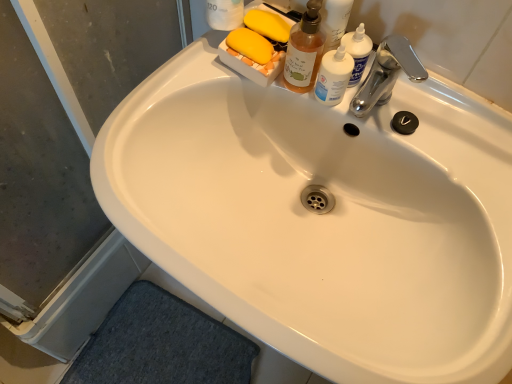
Question: From the image's perspective, is transparent plastic screen door at lower left above or below chrome metallic faucet at upper right?

Choices:
 (A) above
 (B) below

Answer: (B)

Question: Is transparent plastic screen door at lower left to the left or to the right of chrome metallic faucet at upper right in the image?

Choices:
 (A) right
 (B) left

Answer: (B)

Question: Based on their relative distances, which object is nearer to the chrome metallic faucet at upper right?

Choices:
 (A) transparent plastic screen door at lower left
 (B) translucent amber liquid soap dispenser at upper center
 (C) translucent plastic bottle at upper right

Answer: (C)

Question: Estimate the real-world distances between objects in this image. Which object is closer to the translucent plastic bottle at upper right?

Choices:
 (A) translucent amber liquid soap dispenser at upper center
 (B) transparent plastic screen door at lower left
 (C) chrome metallic faucet at upper right

Answer: (A)